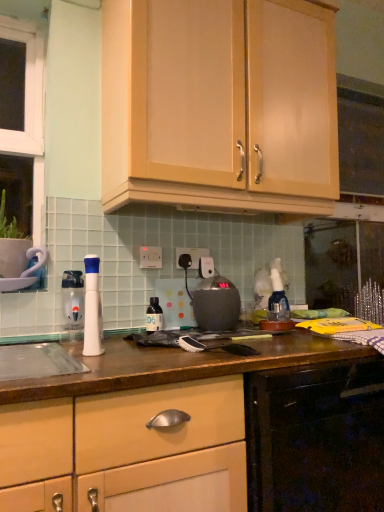
Question: From a real-world perspective, is white plastic electric outlet at center, placed as the 1th electric outlet when sorted from back to front, beneath translucent plastic bottle at center, which is the 2th bottle in front-to-back order?

Choices:
 (A) yes
 (B) no

Answer: (B)

Question: Is white plastic electric outlet at center, which is counted as the second electric outlet, starting from the left, not within translucent plastic bottle at center, the 2th bottle from the left?

Choices:
 (A) yes
 (B) no

Answer: (A)

Question: Would you say white plastic electric outlet at center, placed as the 1th electric outlet when sorted from back to front, is a long distance from translucent plastic bottle at center, acting as the first bottle starting from the right?

Choices:
 (A) yes
 (B) no

Answer: (B)

Question: Is white plastic electric outlet at center, the second electric outlet from the front, thinner than translucent plastic bottle at center, which is the 2th bottle in front-to-back order?

Choices:
 (A) yes
 (B) no

Answer: (A)

Question: Considering the relative positions of white plastic electric outlet at center, which is counted as the second electric outlet, starting from the left, and translucent plastic bottle at center, the 2th bottle from the left, in the image provided, is white plastic electric outlet at center, which is counted as the second electric outlet, starting from the left, to the right of translucent plastic bottle at center, the 2th bottle from the left, from the viewer's perspective?

Choices:
 (A) no
 (B) yes

Answer: (B)

Question: Can you confirm if white plastic electric outlet at center, which is counted as the second electric outlet, starting from the left, is positioned to the left of translucent plastic bottle at center, the 2th bottle from the left?

Choices:
 (A) no
 (B) yes

Answer: (A)

Question: From a real-world perspective, is white plastic electric outlet at center, arranged as the 1th electric outlet when viewed from the left, located higher than matte black kettle at center?

Choices:
 (A) no
 (B) yes

Answer: (B)

Question: From a real-world perspective, is white plastic electric outlet at center, arranged as the 2th electric outlet when viewed from the back, beneath matte black kettle at center?

Choices:
 (A) no
 (B) yes

Answer: (A)

Question: Is white plastic electric outlet at center, arranged as the 2th electric outlet when viewed from the back, outside of matte black kettle at center?

Choices:
 (A) no
 (B) yes

Answer: (B)

Question: Does white plastic electric outlet at center, arranged as the 2th electric outlet when viewed from the back, have a lesser height compared to matte black kettle at center?

Choices:
 (A) yes
 (B) no

Answer: (A)

Question: Would you consider white plastic electric outlet at center, which is counted as the 1th electric outlet, starting from the front, to be distant from matte black kettle at center?

Choices:
 (A) yes
 (B) no

Answer: (B)

Question: From the image's perspective, is white plastic electric outlet at center, arranged as the 1th electric outlet when viewed from the left, below matte black kettle at center?

Choices:
 (A) no
 (B) yes

Answer: (A)

Question: Is matte wood cabinet at upper center, the 2th cabinetry in the bottom-to-top sequence, positioned behind translucent plastic bottle at center, the 2th bottle from the left?

Choices:
 (A) no
 (B) yes

Answer: (A)